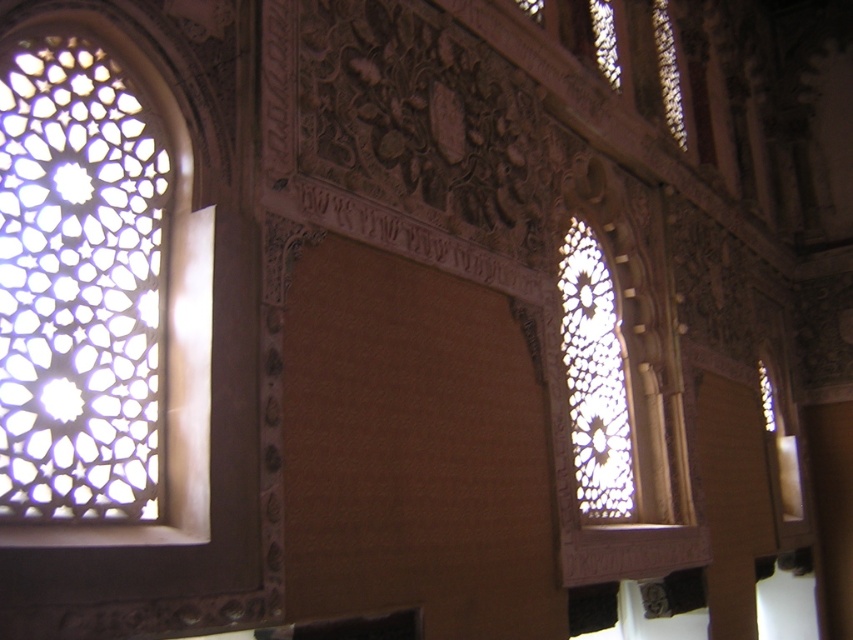
Who is lower down, transparent glass window at left or transparent glass window at right?

Positioned lower is transparent glass window at right.

Who is shorter, transparent glass window at left or transparent glass window at right?

transparent glass window at left

Which is behind, point (32, 144) or point (596, 326)?

Positioned behind is point (596, 326).

You are a GUI agent. You are given a task and a screenshot of the screen. Output one action in this format:
    pyautogui.click(x=<x>, y=<y>)
    Task: Click on the transparent glass window at left
    This screenshot has width=853, height=640.
    Given the screenshot: What is the action you would take?
    pyautogui.click(x=79, y=285)